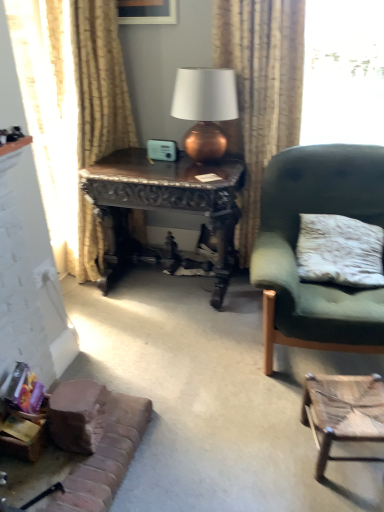
What are the coordinates of `wooden picture frame at upper center` in the screenshot? It's located at (147, 11).

At what (x,y) coordinates should I click in order to perform the action: click on velvet green armchair at right. Please return your answer as a coordinate pair (x, y). Looking at the image, I should click on point(296,244).

Is point (130, 1) closer or farther from the camera than point (93, 256)?

Point (130, 1) is positioned closer to the camera compared to point (93, 256).

Is wooden picture frame at upper center in contact with beige textured curtain at left, placed as the second curtain when sorted from right to left?

They are not placed beside each other.

Which is correct: wooden picture frame at upper center is inside beige textured curtain at left, the first curtain in the left-to-right sequence, or outside of it?

wooden picture frame at upper center is not inside beige textured curtain at left, the first curtain in the left-to-right sequence, it's outside.

Could you measure the distance between wooden picture frame at upper center and beige textured curtain at left, placed as the second curtain when sorted from right to left?

wooden picture frame at upper center is 60.03 centimeters from beige textured curtain at left, placed as the second curtain when sorted from right to left.

Is there a large distance between beige textured curtain at left, the first curtain in the left-to-right sequence, and wooden woven stool at lower right?

Yes, beige textured curtain at left, the first curtain in the left-to-right sequence, and wooden woven stool at lower right are quite far apart.

Is wooden woven stool at lower right completely or partially inside beige textured curtain at left, placed as the second curtain when sorted from right to left?

That's incorrect, wooden woven stool at lower right is not inside beige textured curtain at left, placed as the second curtain when sorted from right to left.

Considering the points (32, 84) and (351, 384), which point is in front, point (32, 84) or point (351, 384)?

The point (351, 384) is more forward.

I want to click on stool that is on the right side of beige textured curtain at left, placed as the second curtain when sorted from right to left, so coord(343,413).

Is beige textured curtain at left, placed as the second curtain when sorted from right to left, turned away from textured beige curtain at upper center, the second curtain in the left-to-right sequence?

No.

From a real-world perspective, which object stands above the other?

textured beige curtain at upper center, marked as the 1th curtain in a right-to-left arrangement, is physically above.

Between point (117, 129) and point (279, 86), which one is positioned in front?

Point (279, 86)

In the image, is beige textured curtain at left, the first curtain in the left-to-right sequence, on the left side or the right side of brown fabric couch at lower left?

beige textured curtain at left, the first curtain in the left-to-right sequence, is positioned on brown fabric couch at lower left's left side.

Is beige textured curtain at left, placed as the second curtain when sorted from right to left, looking in the opposite direction of brown fabric couch at lower left?

beige textured curtain at left, placed as the second curtain when sorted from right to left, does not have its back to brown fabric couch at lower left.

In terms of height, does beige textured curtain at left, placed as the second curtain when sorted from right to left, look taller or shorter compared to brown fabric couch at lower left?

Clearly, beige textured curtain at left, placed as the second curtain when sorted from right to left, is taller compared to brown fabric couch at lower left.

Would you say dark wood carved desk at center is inside or outside beige textured curtain at left, the first curtain in the left-to-right sequence?

dark wood carved desk at center is not inside beige textured curtain at left, the first curtain in the left-to-right sequence, it's outside.

From the picture: Is dark wood carved desk at center looking in the opposite direction of beige textured curtain at left, the first curtain in the left-to-right sequence?

dark wood carved desk at center does not have its back to beige textured curtain at left, the first curtain in the left-to-right sequence.

Could you measure the distance between dark wood carved desk at center and beige textured curtain at left, the first curtain in the left-to-right sequence?

dark wood carved desk at center and beige textured curtain at left, the first curtain in the left-to-right sequence, are 16.10 inches apart from each other.

What's the angular difference between dark wood carved desk at center and beige textured curtain at left, the first curtain in the left-to-right sequence,'s facing directions?

91.2 degrees.

Who is bigger, copper metallic lamp at upper center or wooden woven stool at lower right?

copper metallic lamp at upper center is bigger.

Considering the sizes of copper metallic lamp at upper center and wooden woven stool at lower right in the image, is copper metallic lamp at upper center wider or thinner than wooden woven stool at lower right?

In the image, copper metallic lamp at upper center appears to be wider than wooden woven stool at lower right.

How many degrees apart are the facing directions of copper metallic lamp at upper center and wooden woven stool at lower right?

15.3 degrees separate the facing orientations of copper metallic lamp at upper center and wooden woven stool at lower right.

Does copper metallic lamp at upper center contain wooden woven stool at lower right?

Definitely not — wooden woven stool at lower right is not inside copper metallic lamp at upper center.

Considering the relative sizes of wooden woven stool at lower right and brown fabric couch at lower left in the image provided, is wooden woven stool at lower right thinner than brown fabric couch at lower left?

Indeed, wooden woven stool at lower right has a lesser width compared to brown fabric couch at lower left.

Is wooden woven stool at lower right inside the boundaries of brown fabric couch at lower left, or outside?

wooden woven stool at lower right is not inside brown fabric couch at lower left, it's outside.

Considering the relative sizes of wooden woven stool at lower right and brown fabric couch at lower left in the image provided, is wooden woven stool at lower right shorter than brown fabric couch at lower left?

In fact, wooden woven stool at lower right may be taller than brown fabric couch at lower left.

Is wooden woven stool at lower right turned away from brown fabric couch at lower left?

No, wooden woven stool at lower right is not facing the opposite direction of brown fabric couch at lower left.

Where is `picture frame on the right of beige textured curtain at left, placed as the second curtain when sorted from right to left`? The width and height of the screenshot is (384, 512). picture frame on the right of beige textured curtain at left, placed as the second curtain when sorted from right to left is located at coordinates (147, 11).

Where is `the 1st curtain located above the wooden woven stool at lower right (from a real-world perspective)`? This screenshot has width=384, height=512. the 1st curtain located above the wooden woven stool at lower right (from a real-world perspective) is located at coordinates (71, 111).

Looking at the image, which one is located further to beige textured curtain at left, the first curtain in the left-to-right sequence, textured beige curtain at upper center, the second curtain in the left-to-right sequence, or brown fabric couch at lower left?

brown fabric couch at lower left is positioned further to the anchor beige textured curtain at left, the first curtain in the left-to-right sequence.

From the image, which object appears to be nearer to brown fabric couch at lower left, textured beige curtain at upper center, marked as the 1th curtain in a right-to-left arrangement, or wooden woven stool at lower right?

wooden woven stool at lower right.

Considering their positions, is brown fabric couch at lower left positioned further to wooden woven stool at lower right than wooden picture frame at upper center?

wooden picture frame at upper center.

Estimate the real-world distances between objects in this image. Which object is further from beige textured curtain at left, the first curtain in the left-to-right sequence, wooden woven stool at lower right or wooden picture frame at upper center?

Answer: Based on the image, wooden woven stool at lower right appears to be further to beige textured curtain at left, the first curtain in the left-to-right sequence.

Considering their positions, is dark wood carved desk at center positioned further to wooden woven stool at lower right than beige textured curtain at left, the first curtain in the left-to-right sequence?

beige textured curtain at left, the first curtain in the left-to-right sequence, is further to wooden woven stool at lower right.

Looking at the image, which one is located closer to wooden picture frame at upper center, wooden woven stool at lower right or beige textured curtain at left, the first curtain in the left-to-right sequence?

beige textured curtain at left, the first curtain in the left-to-right sequence, is positioned closer to the anchor wooden picture frame at upper center.

When comparing their distances from beige textured curtain at left, the first curtain in the left-to-right sequence, does wooden picture frame at upper center or wooden woven stool at lower right seem closer?

The object closer to beige textured curtain at left, the first curtain in the left-to-right sequence, is wooden picture frame at upper center.

Looking at this image, based on their spatial positions, is textured beige curtain at upper center, marked as the 1th curtain in a right-to-left arrangement, or wooden picture frame at upper center further from beige textured curtain at left, placed as the second curtain when sorted from right to left?

The object further to beige textured curtain at left, placed as the second curtain when sorted from right to left, is textured beige curtain at upper center, marked as the 1th curtain in a right-to-left arrangement.

The height and width of the screenshot is (512, 384). What are the coordinates of `couch located between beige textured curtain at left, the first curtain in the left-to-right sequence, and velvet green armchair at right in the left-right direction` in the screenshot? It's located at (104, 454).

Locate an element on the screen. stool between beige textured curtain at left, the first curtain in the left-to-right sequence, and velvet green armchair at right from left to right is located at coordinates (343, 413).

Locate an element on the screen. stool between beige textured curtain at left, the first curtain in the left-to-right sequence, and brown fabric couch at lower left from top to bottom is located at coordinates (343, 413).

At what (x,y) coordinates should I click in order to perform the action: click on lamp between beige textured curtain at left, the first curtain in the left-to-right sequence, and textured beige curtain at upper center, marked as the 1th curtain in a right-to-left arrangement. Please return your answer as a coordinate pair (x, y). The width and height of the screenshot is (384, 512). Looking at the image, I should click on (205, 108).